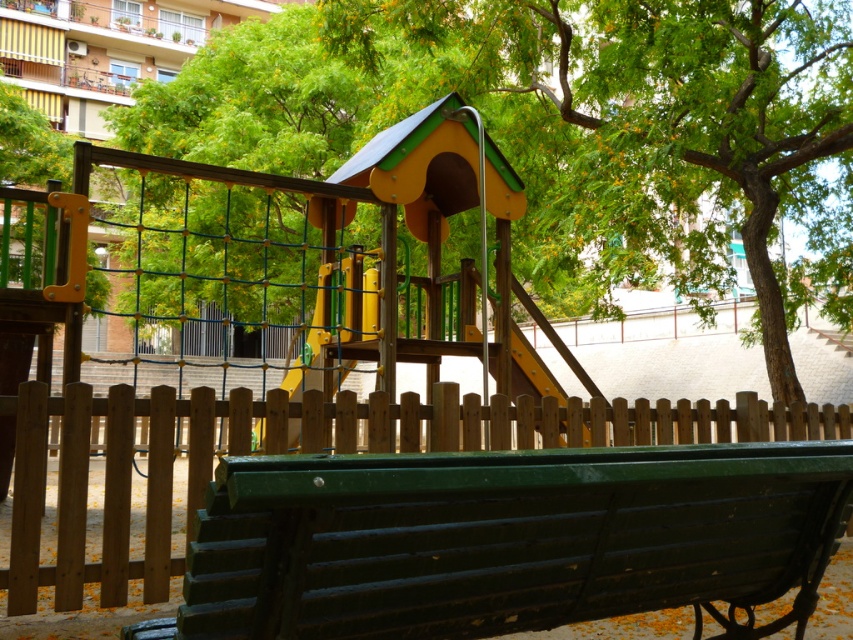
You are a parent trying to find shade for your child. You see the green painted wood bench at lower center and the green leafy tree at center. Which object provides shade for the bench?

The green leafy tree at center provides shade for the green painted wood bench at lower center because the bench is positioned under the tree.

You are a parent trying to find shade for your child. You see the green painted wood bench at lower center and the green leafy tree at center. Which object is closer to you?

The green painted wood bench at lower center is closer to you because it is in front of the green leafy tree at center.